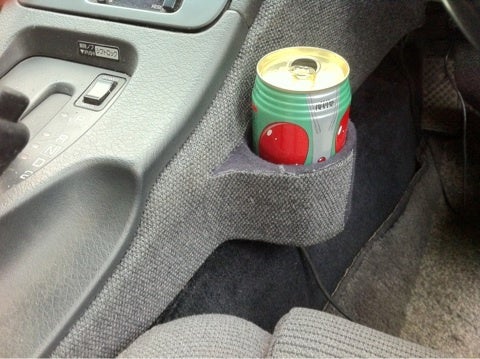
Image resolution: width=480 pixels, height=359 pixels. In order to click on seat in this screenshot , I will do `click(309, 345)`.